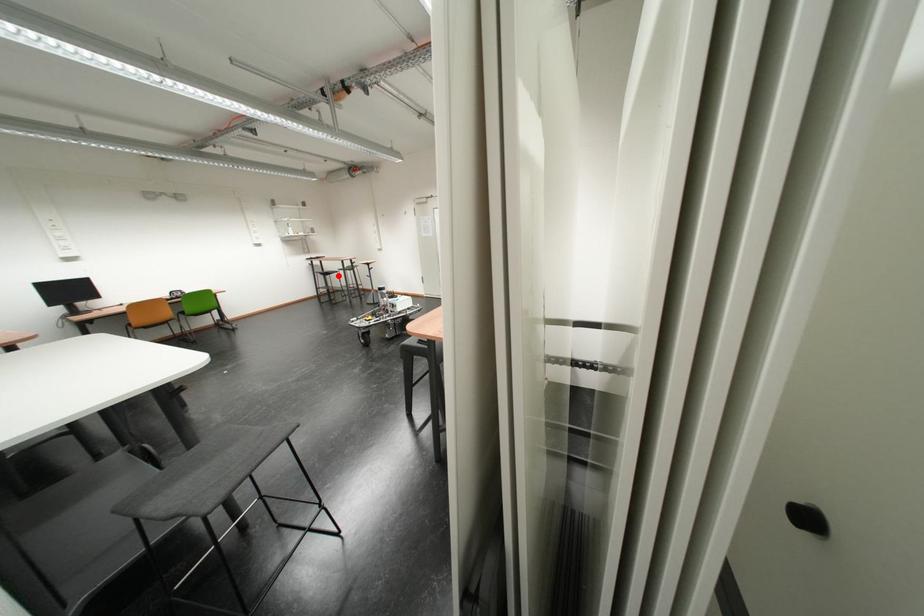
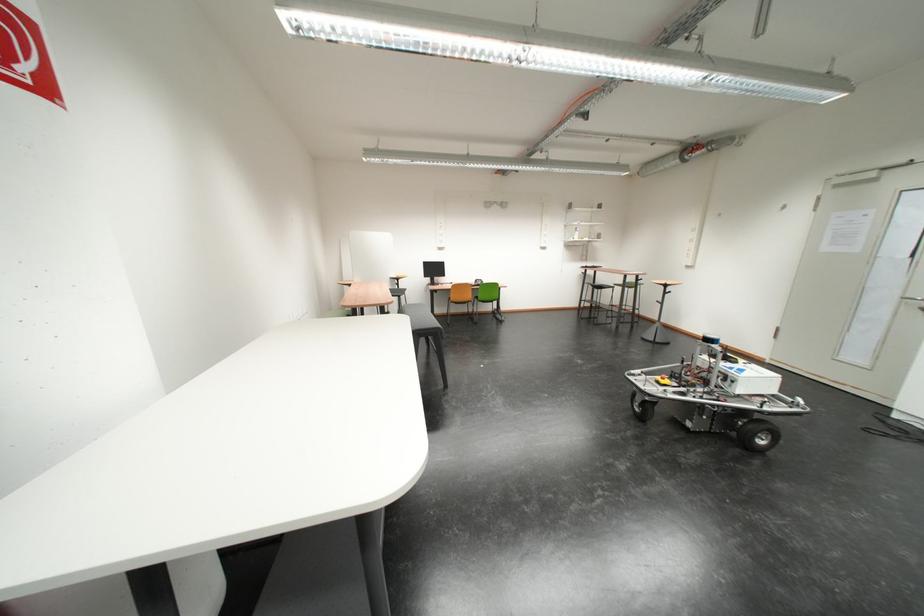
Question: I am providing you with two images of the same scene from different viewpoints. Image1 has a red point marked. In image2, the corresponding 3D location appears at what relative position? Reply with the corresponding letter.

Choices:
 (A) Closer
 (B) Farther

Answer: (A)